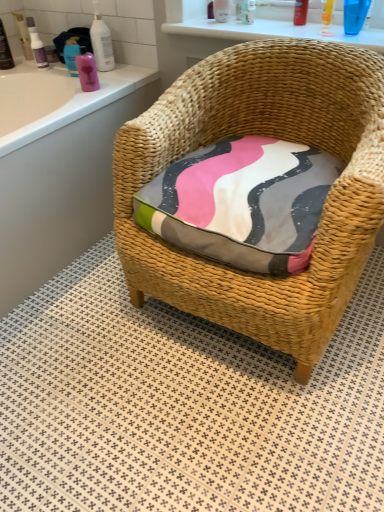
Where is `unoccupied region to the right of translucent plastic bottle at upper center, acting as the 7th toiletry starting from the left`? This screenshot has height=512, width=384. unoccupied region to the right of translucent plastic bottle at upper center, acting as the 7th toiletry starting from the left is located at coordinates (263, 22).